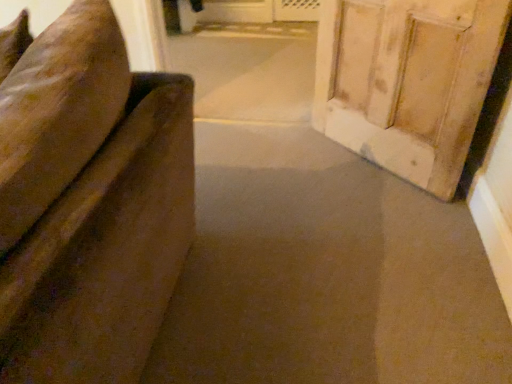
Image resolution: width=512 pixels, height=384 pixels. Describe the element at coordinates (247, 57) in the screenshot. I see `velvet-like brown couch at left` at that location.

Where is `velvet-like brown couch at left`? The width and height of the screenshot is (512, 384). velvet-like brown couch at left is located at coordinates (247, 57).

This screenshot has height=384, width=512. What do you see at coordinates (407, 81) in the screenshot?
I see `wooden door at right` at bounding box center [407, 81].

The image size is (512, 384). I want to click on wooden door at right, so click(407, 81).

Locate an element on the screen. The height and width of the screenshot is (384, 512). velvet-like brown couch at left is located at coordinates pos(247,57).

Considering the relative positions of wooden door at right and velvet-like brown couch at left in the image provided, is wooden door at right to the right of velvet-like brown couch at left from the viewer's perspective?

Correct, you'll find wooden door at right to the right of velvet-like brown couch at left.

Is wooden door at right in front of velvet-like brown couch at left?

Yes, wooden door at right is closer to the viewer.

Does point (377, 19) appear closer or farther from the camera than point (217, 50)?

Point (377, 19) is positioned closer to the camera compared to point (217, 50).

From the image's perspective, is wooden door at right beneath velvet-like brown couch at left?

Yes, from the image's perspective, wooden door at right is below velvet-like brown couch at left.

From a real-world perspective, is wooden door at right located beneath velvet-like brown couch at left?

No, from a real-world perspective, wooden door at right is not below velvet-like brown couch at left.

Considering the relative sizes of wooden door at right and velvet-like brown couch at left in the image provided, is wooden door at right thinner than velvet-like brown couch at left?

Yes, wooden door at right is thinner than velvet-like brown couch at left.

Which of these two, wooden door at right or velvet-like brown couch at left, stands shorter?

velvet-like brown couch at left is shorter.

Can you confirm if wooden door at right is smaller than velvet-like brown couch at left?

Correct, wooden door at right occupies less space than velvet-like brown couch at left.

Is wooden door at right located outside velvet-like brown couch at left?

Yes, wooden door at right is outside of velvet-like brown couch at left.

Is wooden door at right positioned far away from velvet-like brown couch at left?

That's not correct — wooden door at right is a little close to velvet-like brown couch at left.

Could you tell me if wooden door at right is facing velvet-like brown couch at left?

No, wooden door at right does not turn towards velvet-like brown couch at left.

What's the angular difference between wooden door at right and velvet-like brown couch at left's facing directions?

The angular difference between wooden door at right and velvet-like brown couch at left is 46.3 degrees.

How far apart are wooden door at right and velvet-like brown couch at left?

wooden door at right is 33.29 inches from velvet-like brown couch at left.

Where is `passage behind the wooden door at right`? passage behind the wooden door at right is located at coordinates (247, 57).

Considering the relative positions of velvet-like brown couch at left and wooden door at right in the image provided, is velvet-like brown couch at left to the right of wooden door at right from the viewer's perspective?

No, velvet-like brown couch at left is not to the right of wooden door at right.

Based on the photo, is the depth of velvet-like brown couch at left less than that of wooden door at right?

No, it is not.

Is point (248, 67) positioned in front of point (345, 39)?

No, it is behind (345, 39).

From the image's perspective, is velvet-like brown couch at left positioned above or below wooden door at right?

velvet-like brown couch at left is above wooden door at right.

From a real-world perspective, between velvet-like brown couch at left and wooden door at right, who is vertically lower?

velvet-like brown couch at left.

Is velvet-like brown couch at left wider or thinner than wooden door at right?

velvet-like brown couch at left is wider than wooden door at right.

Is velvet-like brown couch at left taller or shorter than wooden door at right?

Considering their sizes, velvet-like brown couch at left has less height than wooden door at right.

Can you confirm if velvet-like brown couch at left is smaller than wooden door at right?

Actually, velvet-like brown couch at left might be larger than wooden door at right.

From the picture: Is velvet-like brown couch at left outside of wooden door at right?

velvet-like brown couch at left is positioned outside wooden door at right.

Is the surface of velvet-like brown couch at left in direct contact with wooden door at right?

There is a gap between velvet-like brown couch at left and wooden door at right.

From the picture: Is velvet-like brown couch at left oriented towards wooden door at right?

No, velvet-like brown couch at left is not facing towards wooden door at right.

How many degrees apart are the facing directions of velvet-like brown couch at left and wooden door at right?

They differ by 46.3 degrees in their facing directions.

Measure the distance between velvet-like brown couch at left and wooden door at right.

velvet-like brown couch at left and wooden door at right are 33.29 inches apart from each other.

Identify the location of door above the velvet-like brown couch at left (from a real-world perspective). The height and width of the screenshot is (384, 512). (407, 81).

At what (x,y) coordinates should I click in order to perform the action: click on door that appears on the right of velvet-like brown couch at left. Please return your answer as a coordinate pair (x, y). Image resolution: width=512 pixels, height=384 pixels. Looking at the image, I should click on point(407,81).

I want to click on passage above the wooden door at right (from the image's perspective), so click(247, 57).